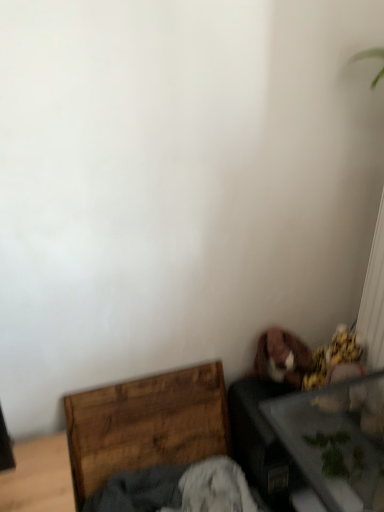
Locate an element on the screen. wooden crate at lower left is located at coordinates (146, 425).

Measure the distance between point [210,430] and camera.

Point [210,430] is 1.50 meters from camera.

The image size is (384, 512). What do you see at coordinates (146, 425) in the screenshot? I see `wooden crate at lower left` at bounding box center [146, 425].

In order to face transparent glass table at lower right, should I rotate leftwards or rightwards?

You should rotate right by 22.149 degrees.

This screenshot has width=384, height=512. What do you see at coordinates (336, 440) in the screenshot?
I see `transparent glass table at lower right` at bounding box center [336, 440].

At what (x,y) coordinates should I click in order to perform the action: click on transparent glass table at lower right. Please return your answer as a coordinate pair (x, y). Looking at the image, I should click on (336, 440).

Locate an element on the screen. wooden crate at lower left is located at coordinates (146, 425).

Does transparent glass table at lower right appear on the left side of wooden crate at lower left?

In fact, transparent glass table at lower right is to the right of wooden crate at lower left.

Is transparent glass table at lower right closer to the viewer compared to wooden crate at lower left?

Yes, transparent glass table at lower right is closer to the viewer.

Is point (296, 434) positioned before point (130, 408)?

Yes, it is.

From the image's perspective, is transparent glass table at lower right above or below wooden crate at lower left?

transparent glass table at lower right is below wooden crate at lower left.

From a real-world perspective, who is located higher, transparent glass table at lower right or wooden crate at lower left?

From a 3D spatial view, transparent glass table at lower right is above.

Does transparent glass table at lower right have a greater width compared to wooden crate at lower left?

Yes, transparent glass table at lower right is wider than wooden crate at lower left.

From the picture: Who is shorter, transparent glass table at lower right or wooden crate at lower left?

wooden crate at lower left is shorter.

Between transparent glass table at lower right and wooden crate at lower left, which one has smaller size?

With smaller size is wooden crate at lower left.

Does transparent glass table at lower right contain wooden crate at lower left?

No, wooden crate at lower left is not surrounded by transparent glass table at lower right.

Is transparent glass table at lower right not near wooden crate at lower left?

transparent glass table at lower right is actually quite close to wooden crate at lower left.

Is transparent glass table at lower right turned away from wooden crate at lower left?

No, transparent glass table at lower right is not facing the opposite direction of wooden crate at lower left.

Where is `furniture on the left of the transparent glass table at lower right`? The height and width of the screenshot is (512, 384). furniture on the left of the transparent glass table at lower right is located at coordinates (146, 425).

Can you confirm if wooden crate at lower left is positioned to the left of transparent glass table at lower right?

Yes, wooden crate at lower left is to the left of transparent glass table at lower right.

Is wooden crate at lower left in front of transparent glass table at lower right?

No.

Does point (98, 483) come in front of point (347, 394)?

No, (98, 483) is behind (347, 394).

From the image's perspective, between wooden crate at lower left and transparent glass table at lower right, which one is located above?

wooden crate at lower left, from the image's perspective.

From a real-world perspective, is wooden crate at lower left under transparent glass table at lower right?

Yes, from a real-world perspective, wooden crate at lower left is below transparent glass table at lower right.

Looking at their sizes, would you say wooden crate at lower left is wider or thinner than transparent glass table at lower right?

In the image, wooden crate at lower left appears to be more narrow than transparent glass table at lower right.

Considering the sizes of objects wooden crate at lower left and transparent glass table at lower right in the image provided, who is taller, wooden crate at lower left or transparent glass table at lower right?

Standing taller between the two is transparent glass table at lower right.

Is wooden crate at lower left bigger than transparent glass table at lower right?

No.

Is wooden crate at lower left situated inside transparent glass table at lower right or outside?

wooden crate at lower left is not inside transparent glass table at lower right, it's outside.

Looking at this image, would you consider wooden crate at lower left to be distant from transparent glass table at lower right?

They are positioned close to each other.

Is transparent glass table at lower right at the back of wooden crate at lower left?

That's not correct — wooden crate at lower left is not looking away from transparent glass table at lower right.

How many degrees apart are the facing directions of wooden crate at lower left and transparent glass table at lower right?

The angular difference between wooden crate at lower left and transparent glass table at lower right is 88.3 degrees.

At what (x,y) coordinates should I click in order to perform the action: click on table on the right of wooden crate at lower left. Please return your answer as a coordinate pair (x, y). This screenshot has width=384, height=512. Looking at the image, I should click on (336, 440).

Locate an element on the screen. The height and width of the screenshot is (512, 384). furniture that appears below the transparent glass table at lower right (from a real-world perspective) is located at coordinates (146, 425).

At what (x,y) coordinates should I click in order to perform the action: click on table above the wooden crate at lower left (from a real-world perspective). Please return your answer as a coordinate pair (x, y). The height and width of the screenshot is (512, 384). Looking at the image, I should click on [x=336, y=440].